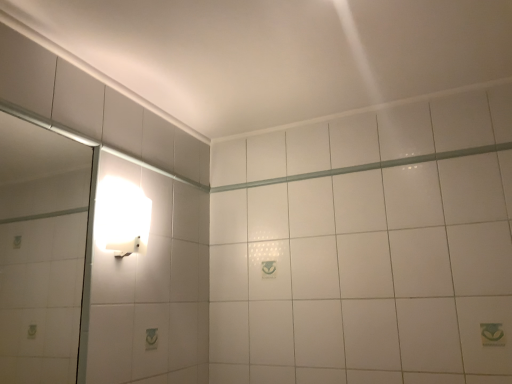
What do you see at coordinates (122, 217) in the screenshot?
I see `white glossy wall sconce at upper left` at bounding box center [122, 217].

Measure the distance between white glossy wall sconce at upper left and camera.

white glossy wall sconce at upper left is 4.46 feet from camera.

The height and width of the screenshot is (384, 512). Find the location of `white glossy wall sconce at upper left`. white glossy wall sconce at upper left is located at coordinates (122, 217).

This screenshot has width=512, height=384. Find the location of `white glossy wall sconce at upper left`. white glossy wall sconce at upper left is located at coordinates (122, 217).